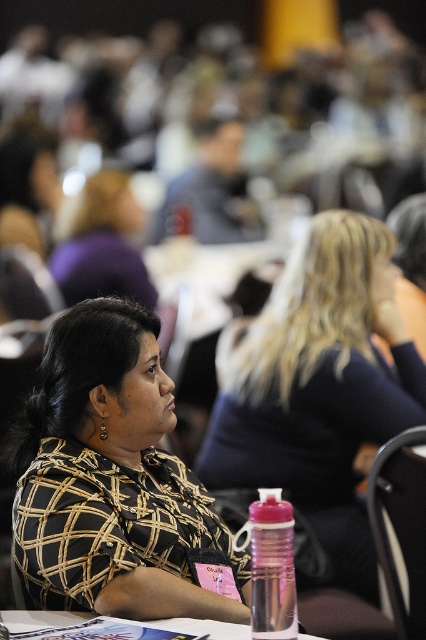
You are standing in the conference room and want to locate the printed fabric shirt at center. Based on the coordinates given, where would you look to find it?

The printed fabric shirt at center is located at the 2D coordinates point (109, 477).

You are a photographer adjusting your camera settings to capture a detailed shot of the printed fabric shirt at center and the smooth black shirt at center. The camera has a depth of field that can focus on objects within a 25 inch range. Will both shirts be in focus at the same time?

The printed fabric shirt at center is 29.42 inches away from the smooth black shirt at center. Since the depth of field can only focus within 25 inches, the two shirts are too far apart to be in focus simultaneously.

You are organizing a clothing display and need to arrange the printed fabric shirt at center and the smooth black shirt at center vertically on a rack. Based on their heights, which shirt should be placed lower on the rack?

The printed fabric shirt at center should be placed lower on the rack because it has a lesser height compared to the smooth black shirt at center, allowing the taller smooth black shirt to be positioned above it.